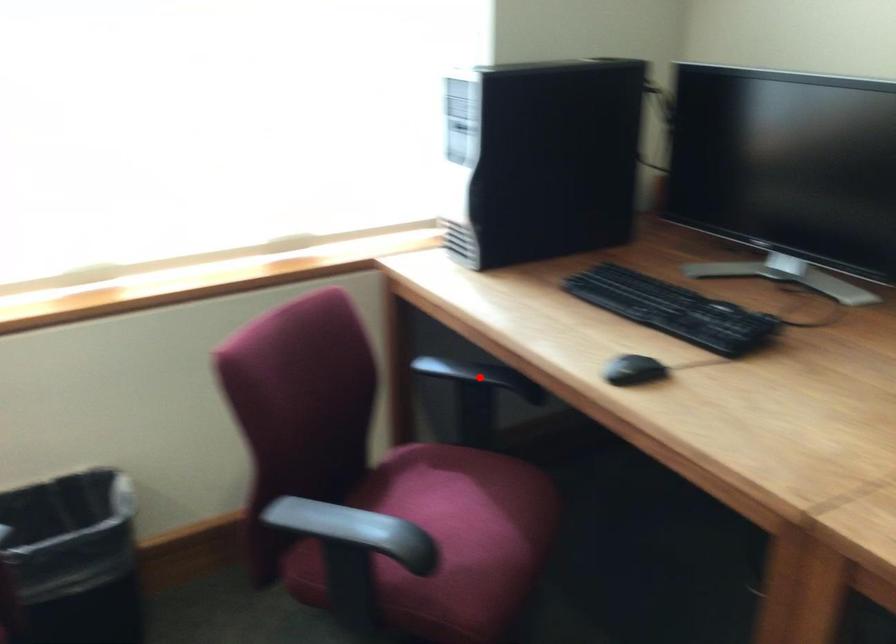
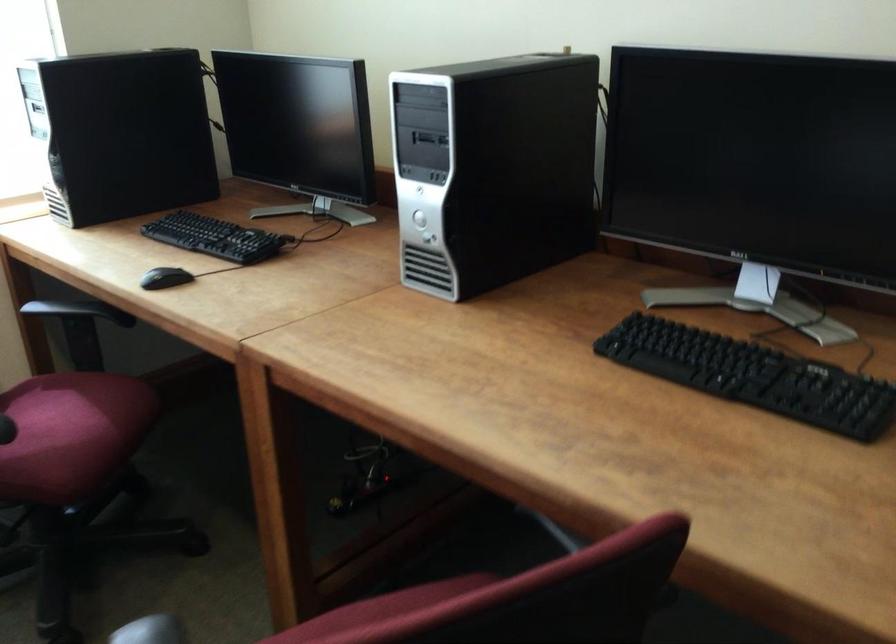
Where in the second image is the point corresponding to the highlighted location from the first image?

(74, 310)